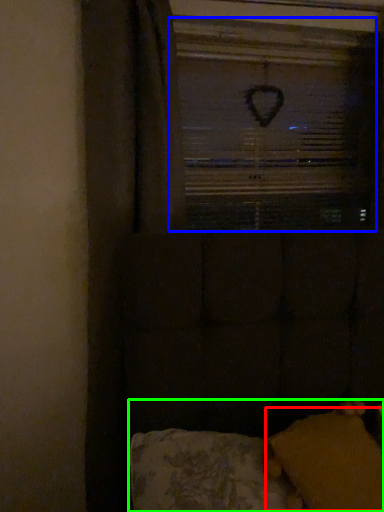
Question: Which is farther away from pillow (highlighted by a red box)? window screen (highlighted by a blue box) or furniture (highlighted by a green box)?

Choices:
 (A) window screen
 (B) furniture

Answer: (A)